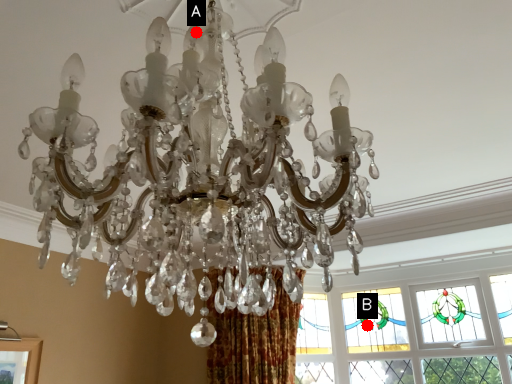
Question: Two points are circled on the image, labeled by A and B beside each circle. Which point is closer to the camera taking this photo?

Choices:
 (A) A is closer
 (B) B is closer

Answer: (A)